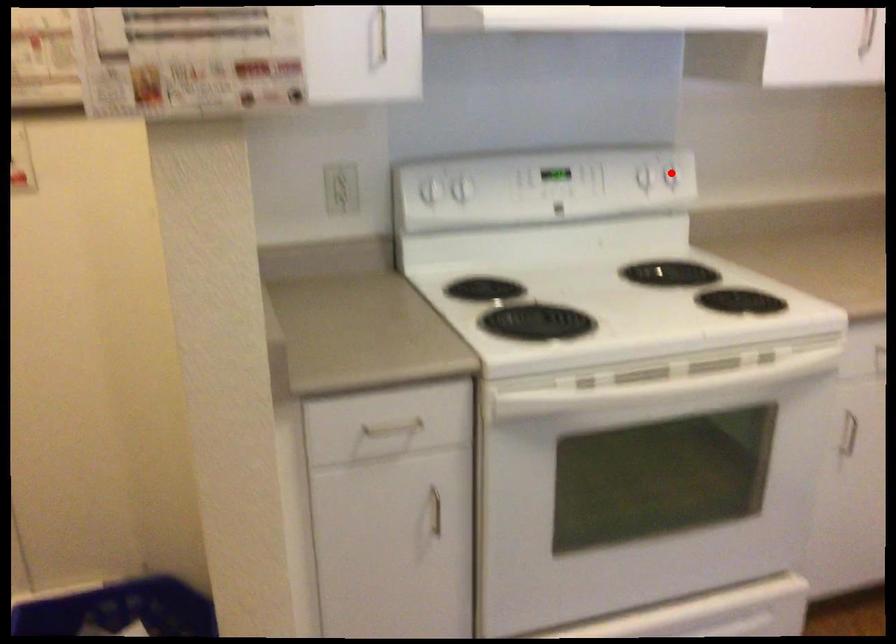
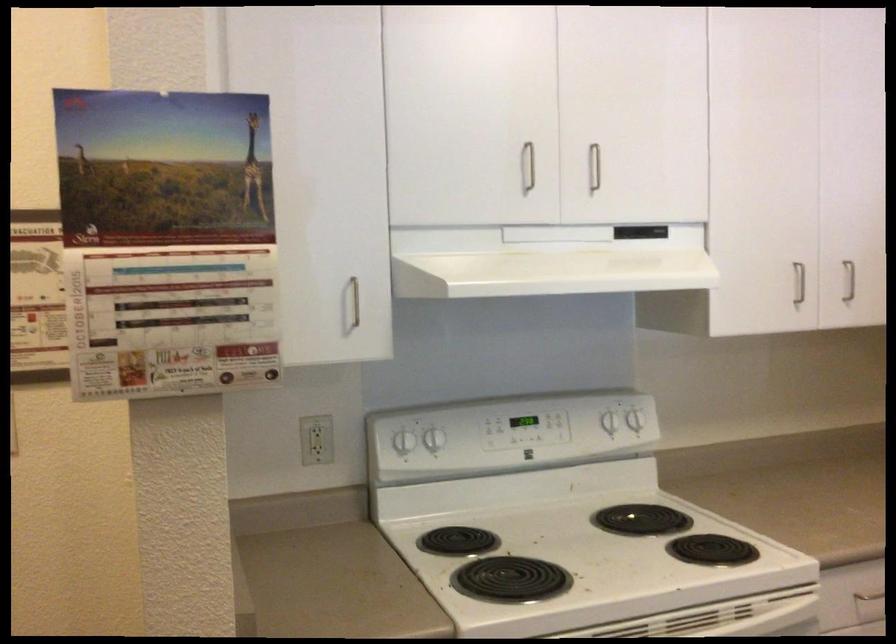
Locate, in the second image, the point that corresponds to the highlighted location in the first image.

(634, 420)